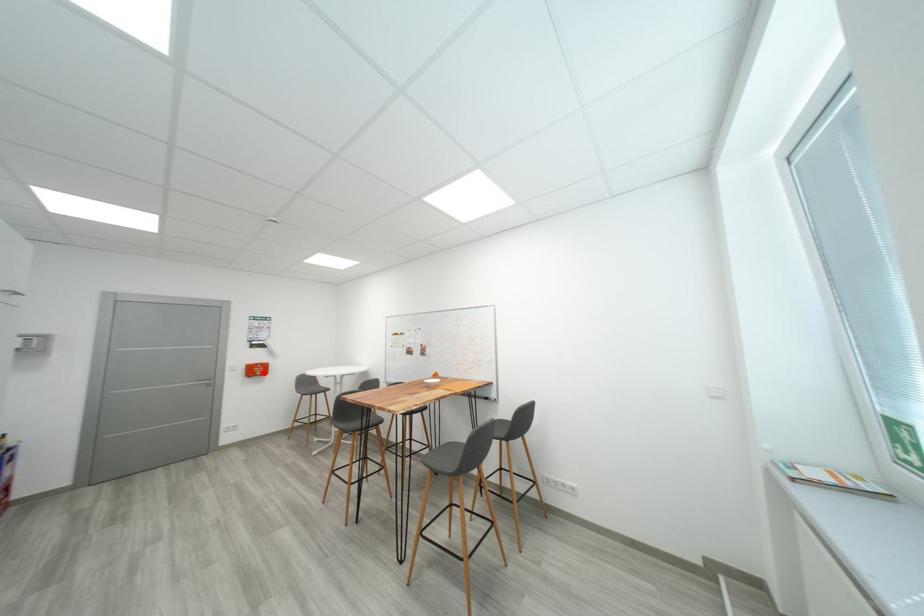
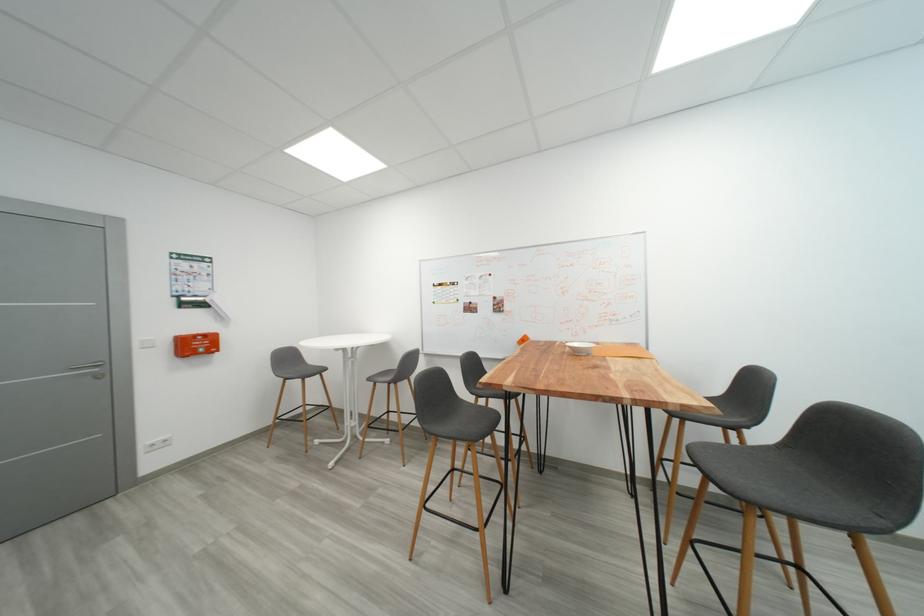
In the second image, find the point that corresponds to the highlighted location in the first image.

(203, 347)